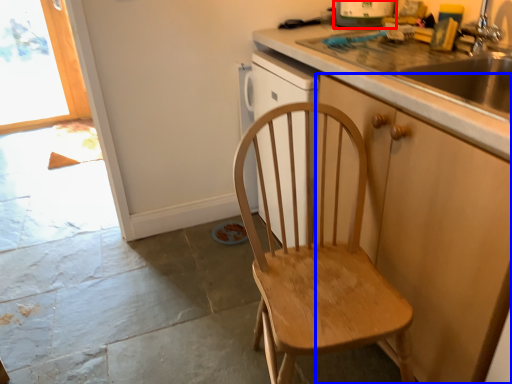
Question: Which object is further to the camera taking this photo, kitchen appliance (highlighted by a red box) or cabinetry (highlighted by a blue box)?

Choices:
 (A) kitchen appliance
 (B) cabinetry

Answer: (A)